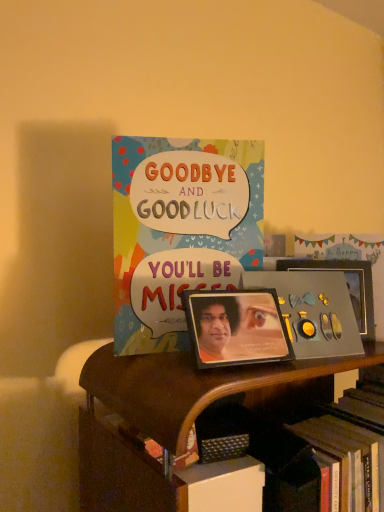
Question: Considering the relative positions of metallic silver album cover at center and wooden bookcase at center in the image provided, is metallic silver album cover at center to the right of wooden bookcase at center from the viewer's perspective?

Choices:
 (A) no
 (B) yes

Answer: (A)

Question: From the image's perspective, is metallic silver album cover at center beneath wooden bookcase at center?

Choices:
 (A) yes
 (B) no

Answer: (B)

Question: Does metallic silver album cover at center come in front of wooden bookcase at center?

Choices:
 (A) yes
 (B) no

Answer: (B)

Question: From a real-world perspective, is metallic silver album cover at center physically above wooden bookcase at center?

Choices:
 (A) yes
 (B) no

Answer: (A)

Question: Can you confirm if metallic silver album cover at center is taller than wooden bookcase at center?

Choices:
 (A) no
 (B) yes

Answer: (A)

Question: From a real-world perspective, is metallic silver album cover at center positioned under wooden bookcase at center based on gravity?

Choices:
 (A) no
 (B) yes

Answer: (A)

Question: From the image's perspective, is metallic silver picture frame at center-right, marked as the 1th picture frame in a right-to-left arrangement, on metallic silver album cover at center?

Choices:
 (A) no
 (B) yes

Answer: (B)

Question: Is metallic silver picture frame at center-right, the first picture frame viewed from the back, looking in the opposite direction of metallic silver album cover at center?

Choices:
 (A) no
 (B) yes

Answer: (A)

Question: Can you confirm if metallic silver picture frame at center-right, which is the 2th picture frame from left to right, is thinner than metallic silver album cover at center?

Choices:
 (A) no
 (B) yes

Answer: (B)

Question: Is metallic silver picture frame at center-right, which is the 2th picture frame from left to right, to the right of metallic silver album cover at center from the viewer's perspective?

Choices:
 (A) yes
 (B) no

Answer: (A)

Question: Considering the relative sizes of metallic silver picture frame at center-right, the first picture frame viewed from the back, and metallic silver album cover at center in the image provided, is metallic silver picture frame at center-right, the first picture frame viewed from the back, taller than metallic silver album cover at center?

Choices:
 (A) no
 (B) yes

Answer: (A)

Question: Can you see metallic silver picture frame at center-right, which is the 2th picture frame from left to right, touching metallic silver album cover at center?

Choices:
 (A) no
 (B) yes

Answer: (B)

Question: Is metallic photo frame at center, the 2th picture frame when ordered from back to front, further to camera compared to wooden bookcase at center?

Choices:
 (A) yes
 (B) no

Answer: (A)